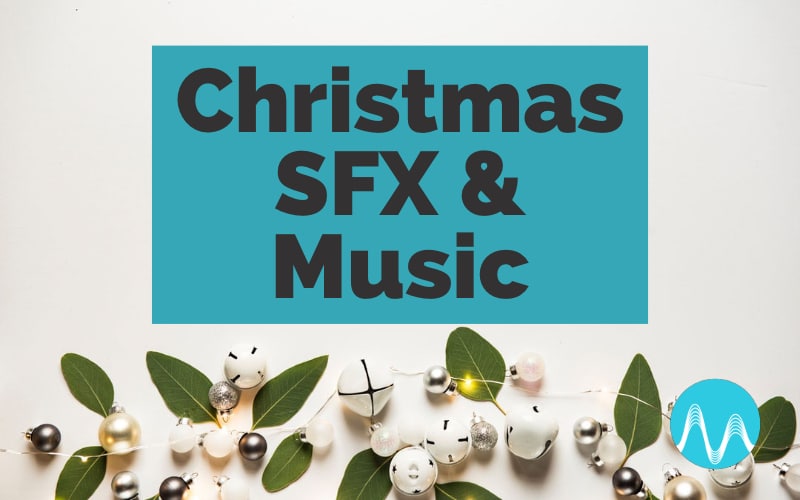
Where is `lights`? lights is located at coordinates (580, 392).